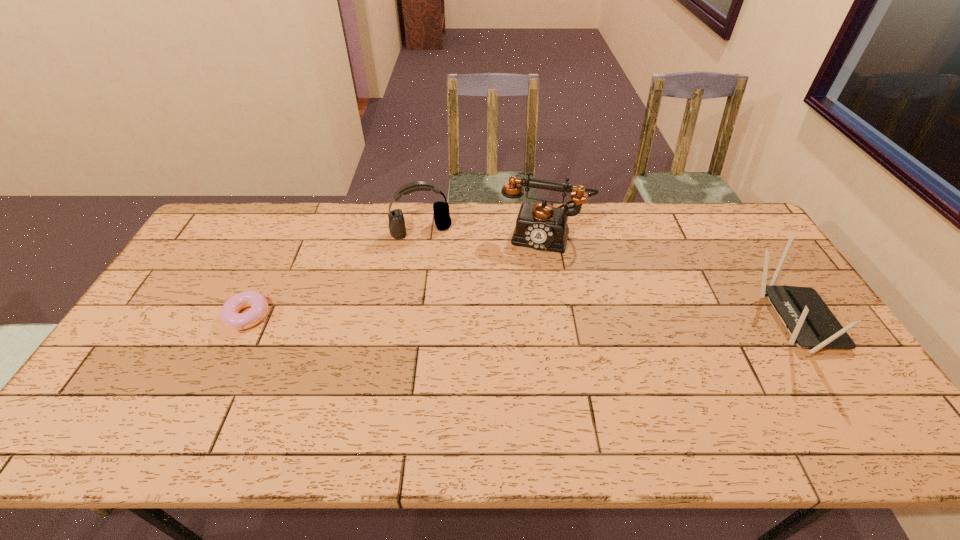
Find the location of a particular element. The width and height of the screenshot is (960, 540). free spot between the router and the telephone is located at coordinates (669, 279).

Select which object appears as the second closest to the telephone. Please provide its 2D coordinates. Your answer should be formatted as a tuple, i.e. [(x, y)], where the tuple contains the x and y coordinates of a point satisfying the conditions above.

[(811, 324)]

Identify the location of the third closest object to the headset. This screenshot has height=540, width=960. (811, 324).

Locate an element on the screen. The image size is (960, 540). blank space that satisfies the following two spatial constraints: 1. on the front side of the third object from right to left; 2. on the front-facing side of the rightmost object is located at coordinates (408, 321).

This screenshot has width=960, height=540. What are the coordinates of `free space that satisfies the following two spatial constraints: 1. on the front side of the rightmost object; 2. on the front-facing side of the shortest object` in the screenshot? It's located at (245, 321).

This screenshot has width=960, height=540. In order to click on vacant point that satisfies the following two spatial constraints: 1. on the front side of the tallest object; 2. on the front-facing side of the router in this screenshot , I will do `click(558, 321)`.

I want to click on vacant position in the image that satisfies the following two spatial constraints: 1. on the front side of the shortest object; 2. on the front-facing side of the router, so click(245, 321).

Find the location of a particular element. The width and height of the screenshot is (960, 540). vacant space that satisfies the following two spatial constraints: 1. on the back side of the second object from left to right; 2. on the right side of the doughnut is located at coordinates (289, 231).

Identify the location of vacant area in the image that satisfies the following two spatial constraints: 1. on the front side of the leftmost object; 2. on the front-facing side of the rightmost object. (245, 321).